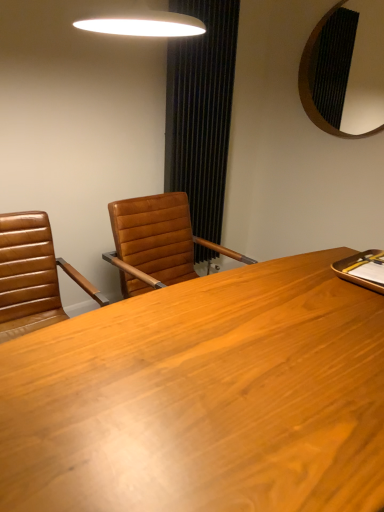
In order to click on wooden desk at center in this screenshot , I will do `click(203, 398)`.

What do you see at coordinates (201, 111) in the screenshot?
I see `black textured curtain at center` at bounding box center [201, 111].

At what (x,y) coordinates should I click in order to perform the action: click on wooden desk at center. Please return your answer as a coordinate pair (x, y). The width and height of the screenshot is (384, 512). Looking at the image, I should click on (203, 398).

Is wooden desk at center surrounded by black textured mirror at upper right?

No, wooden desk at center is not a part of black textured mirror at upper right.

From a real-world perspective, is black textured mirror at upper right positioned over wooden desk at center based on gravity?

Indeed, from a real-world perspective, black textured mirror at upper right stands above wooden desk at center.

Is black textured mirror at upper right taller than wooden desk at center?

Yes, black textured mirror at upper right is taller than wooden desk at center.

Can you confirm if wooden desk at center is shorter than black textured curtain at center?

Yes, wooden desk at center is shorter than black textured curtain at center.

In terms of width, does wooden desk at center look wider or thinner when compared to black textured curtain at center?

In the image, wooden desk at center appears to be wider than black textured curtain at center.

I want to click on desk below the black textured curtain at center (from a real-world perspective), so tap(203, 398).

Is point (206, 482) farther from viewer compared to point (175, 104)?

No, (206, 482) is in front of (175, 104).

Considering the positions of point (48, 251) and point (225, 63), is point (48, 251) closer or farther from the camera than point (225, 63)?

Point (48, 251) is closer to the camera than point (225, 63).

Considering their positions, is brown leather chair at left located in front of or behind black textured curtain at center?

Visually, brown leather chair at left is located in front of black textured curtain at center.

Does brown leather chair at left appear on the right side of black textured curtain at center?

No, brown leather chair at left is not to the right of black textured curtain at center.

Based on the photo, is black textured curtain at center at the back of brown leather chair at left?

That's not correct — brown leather chair at left is not looking away from black textured curtain at center.

Do you think black textured curtain at center is within brown leather chair at left, or outside of it?

black textured curtain at center is not enclosed by brown leather chair at left.

Is black textured curtain at center aimed at brown leather chair at left?

No, black textured curtain at center is not oriented towards brown leather chair at left.

Between black textured curtain at center and brown leather chair at left, which one is positioned in front?

brown leather chair at left.

Measure the distance from black textured mirror at upper right to black textured curtain at center.

black textured mirror at upper right is 3.39 feet from black textured curtain at center.

In the image, is black textured mirror at upper right on the left side or the right side of black textured curtain at center?

Clearly, black textured mirror at upper right is on the right of black textured curtain at center in the image.

How many degrees apart are the facing directions of black textured mirror at upper right and black textured curtain at center?

black textured mirror at upper right and black textured curtain at center are facing 89.6 degrees away from each other.

Who is smaller, black textured mirror at upper right or black textured curtain at center?

Smaller between the two is black textured mirror at upper right.

Does black textured mirror at upper right lie in front of brown leather chair at left?

No, the depth of black textured mirror at upper right is greater than that of brown leather chair at left.

From a real-world perspective, which object stands above the other?

From a 3D spatial view, black textured mirror at upper right is above.

Which is behind, point (319, 126) or point (31, 328)?

The point (319, 126) is farther from the camera.

Can you tell me how much black textured mirror at upper right and brown leather chair at left differ in facing direction?

The angular difference between black textured mirror at upper right and brown leather chair at left is 86.4 degrees.

Is black textured curtain at center shorter than black textured mirror at upper right?

No, black textured curtain at center is not shorter than black textured mirror at upper right.

Do you think black textured curtain at center is within black textured mirror at upper right, or outside of it?

black textured curtain at center cannot be found inside black textured mirror at upper right.

Measure the distance between black textured curtain at center and black textured mirror at upper right.

A distance of 1.03 meters exists between black textured curtain at center and black textured mirror at upper right.

Is black textured curtain at center positioned far away from black textured mirror at upper right?

Indeed, black textured curtain at center is not near black textured mirror at upper right.

The image size is (384, 512). Find the location of `mirror that is on the right side of wooden desk at center`. mirror that is on the right side of wooden desk at center is located at coordinates (345, 70).

Locate an element on the screen. Image resolution: width=384 pixels, height=512 pixels. desk below the black textured curtain at center (from the image's perspective) is located at coordinates tap(203, 398).

Estimate the real-world distances between objects in this image. Which object is further from brown leather chair at left, wooden desk at center or black textured curtain at center?

black textured curtain at center is positioned further to the anchor brown leather chair at left.

Based on their spatial positions, is black textured mirror at upper right or wooden desk at center closer to brown leather chair at left?

wooden desk at center.

From the picture: Which object lies further to the anchor point brown leather chair at left, wooden desk at center or black textured mirror at upper right?

Based on the image, black textured mirror at upper right appears to be further to brown leather chair at left.

Looking at this image, looking at the image, which one is located further to brown leather chair at left, black textured mirror at upper right or black textured curtain at center?

black textured mirror at upper right is positioned further to the anchor brown leather chair at left.

Looking at the image, which one is located further to black textured curtain at center, brown leather chair at left or black textured mirror at upper right?

brown leather chair at left is further to black textured curtain at center.

Estimate the real-world distances between objects in this image. Which object is closer to black textured mirror at upper right, brown leather chair at left or wooden desk at center?

wooden desk at center.

Which object lies nearer to the anchor point black textured mirror at upper right, black textured curtain at center or brown leather chair at left?

The object closer to black textured mirror at upper right is black textured curtain at center.

Considering their positions, is wooden desk at center positioned further to black textured curtain at center than black textured mirror at upper right?

wooden desk at center.

At what (x,y) coordinates should I click in order to perform the action: click on chair positioned between wooden desk at center and black textured curtain at center from near to far. Please return your answer as a coordinate pair (x, y). Looking at the image, I should click on (32, 276).

I want to click on mirror located between wooden desk at center and black textured curtain at center in the depth direction, so click(345, 70).

Locate an element on the screen. This screenshot has width=384, height=512. curtain between brown leather chair at left and black textured mirror at upper right is located at coordinates (201, 111).

Find the location of a particular element. chair that lies between black textured mirror at upper right and wooden desk at center from top to bottom is located at coordinates (32, 276).